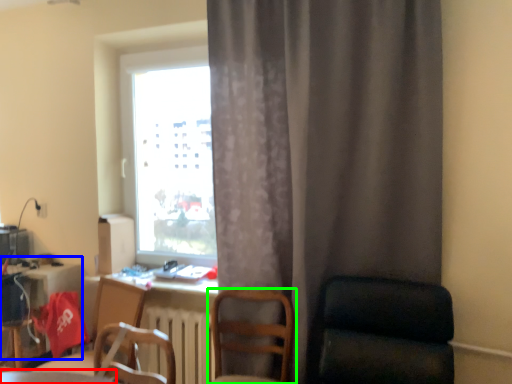
Question: Estimate the real-world distances between objects in this image. Which object is closer to table (highlighted by a red box), computer desk (highlighted by a blue box) or chair (highlighted by a green box)?

Choices:
 (A) computer desk
 (B) chair

Answer: (B)